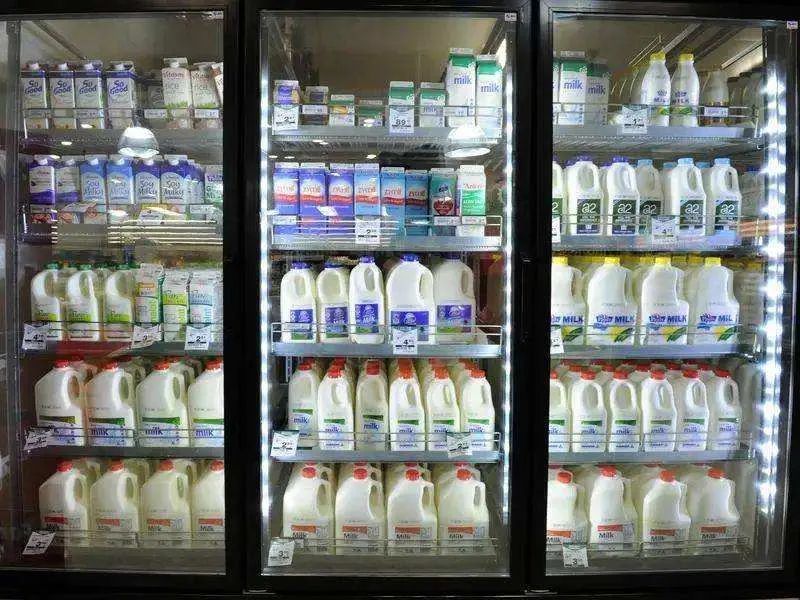
Locate an element on the screen. The height and width of the screenshot is (600, 800). medium jugs with blue tops is located at coordinates (306, 312), (334, 304), (362, 304), (410, 304), (450, 304), (438, 261), (390, 271).